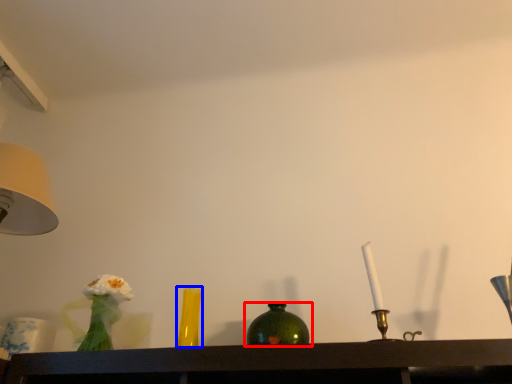
Question: Which point is closer to the camera, bottle (highlighted by a red box) or vase (highlighted by a blue box)?

Choices:
 (A) bottle
 (B) vase

Answer: (A)